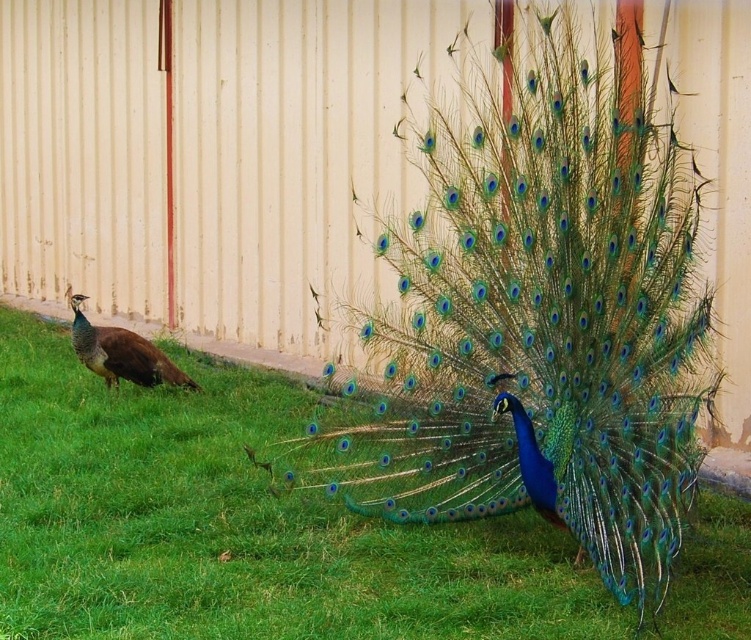
Based on the photo, you are a photographer trying to capture a clear shot of the matte brown peacock at left without the green grass at lower left blocking the view. Based on their positions, is it possible to adjust your angle to avoid the grass obstructing the peacock?

The green grass at lower left is in front of the matte brown peacock at left, so adjusting your angle slightly behind the peacock would allow you to avoid the grass obstructing the view.

You are a photographer standing in front of the shiny blue peacock at center and the matte brown peacock at left. Which peacock is closer to you?

The shiny blue peacock at center is closer to you because it is in front of the matte brown peacock at left.

You are standing in front of the two peacocks and want to place a small decoration between the two points labeled point [385,422] and point [59,515]. Which point is closer to you where you should start placing the decoration?

Point [385,422] is closer to the viewer than point [59,515], so you should start placing the decoration near point [385,422] first.